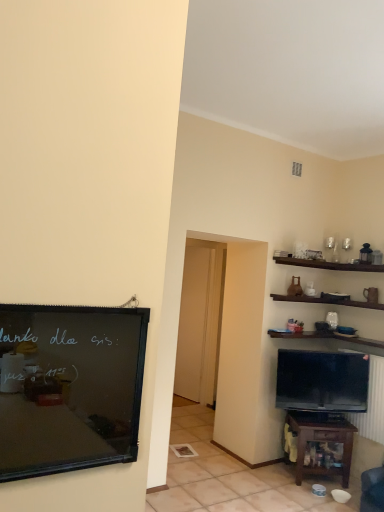
Question: Should I look upward or downward to see black matte bulletin board at left?

Choices:
 (A) down
 (B) up

Answer: (A)

Question: Considering the relative positions of transparent glass door at center and black matte bulletin board at left in the image provided, is transparent glass door at center to the left of black matte bulletin board at left from the viewer's perspective?

Choices:
 (A) yes
 (B) no

Answer: (B)

Question: From a real-world perspective, is transparent glass door at center physically below black matte bulletin board at left?

Choices:
 (A) no
 (B) yes

Answer: (B)

Question: Are transparent glass door at center and black matte bulletin board at left located far from each other?

Choices:
 (A) no
 (B) yes

Answer: (B)

Question: Is transparent glass door at center behind black matte bulletin board at left?

Choices:
 (A) no
 (B) yes

Answer: (B)

Question: Is black matte bulletin board at left surrounded by transparent glass door at center?

Choices:
 (A) no
 (B) yes

Answer: (A)

Question: From the image's perspective, does transparent glass door at center appear lower than black matte bulletin board at left?

Choices:
 (A) yes
 (B) no

Answer: (A)

Question: Can we say matte black tv at lower right lies outside transparent glass door at center?

Choices:
 (A) no
 (B) yes

Answer: (B)

Question: Is matte black tv at lower right far away from transparent glass door at center?

Choices:
 (A) yes
 (B) no

Answer: (A)

Question: Is matte black tv at lower right closer to the viewer compared to transparent glass door at center?

Choices:
 (A) no
 (B) yes

Answer: (B)

Question: Is matte black tv at lower right in contact with transparent glass door at center?

Choices:
 (A) no
 (B) yes

Answer: (A)

Question: Considering the relative sizes of matte black tv at lower right and transparent glass door at center in the image provided, is matte black tv at lower right thinner than transparent glass door at center?

Choices:
 (A) no
 (B) yes

Answer: (A)

Question: From a real-world perspective, is matte black tv at lower right beneath transparent glass door at center?

Choices:
 (A) no
 (B) yes

Answer: (B)

Question: Is brown wooden table at lower right to the right of matte black tv at lower right from the viewer's perspective?

Choices:
 (A) yes
 (B) no

Answer: (B)